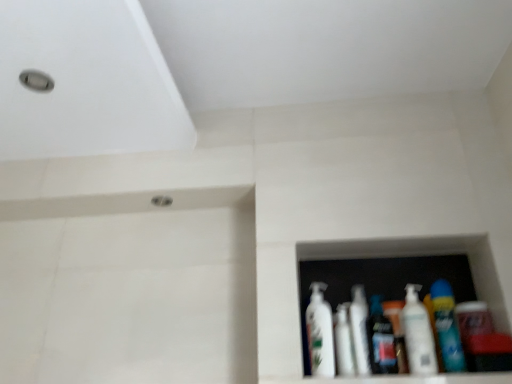
Question: From the image's perspective, is white glossy ledge at lower right beneath white plastic bottle at center, positioned as the first bottle in left-to-right order?

Choices:
 (A) yes
 (B) no

Answer: (A)

Question: Is white plastic bottle at center, positioned as the first bottle in left-to-right order, at the back of white glossy ledge at lower right?

Choices:
 (A) yes
 (B) no

Answer: (B)

Question: Is white glossy ledge at lower right far from white plastic bottle at center, arranged as the 3th bottle when viewed from the right?

Choices:
 (A) yes
 (B) no

Answer: (B)

Question: Is white glossy ledge at lower right wider than white plastic bottle at center, arranged as the 3th bottle when viewed from the right?

Choices:
 (A) yes
 (B) no

Answer: (A)

Question: Is white glossy ledge at lower right further to the viewer compared to white plastic bottle at center, positioned as the first bottle in left-to-right order?

Choices:
 (A) yes
 (B) no

Answer: (B)

Question: Considering the relative sizes of white glossy ledge at lower right and white plastic bottle at center, arranged as the 3th bottle when viewed from the right, in the image provided, is white glossy ledge at lower right thinner than white plastic bottle at center, arranged as the 3th bottle when viewed from the right,?

Choices:
 (A) no
 (B) yes

Answer: (A)

Question: Does white glossy bottle at center, the 2th bottle when ordered from right to left, turn towards white plastic bottle at center, positioned as the first bottle in left-to-right order?

Choices:
 (A) yes
 (B) no

Answer: (B)

Question: Is white glossy bottle at center, the 2th bottle when ordered from left to right, positioned with its back to white plastic bottle at center, positioned as the first bottle in left-to-right order?

Choices:
 (A) no
 (B) yes

Answer: (A)

Question: Is white glossy bottle at center, the 2th bottle when ordered from left to right, to the right of white plastic bottle at center, positioned as the first bottle in left-to-right order, from the viewer's perspective?

Choices:
 (A) no
 (B) yes

Answer: (B)

Question: From a real-world perspective, is white glossy bottle at center, the 2th bottle when ordered from right to left, located beneath white plastic bottle at center, positioned as the first bottle in left-to-right order?

Choices:
 (A) yes
 (B) no

Answer: (A)

Question: Does white glossy bottle at center, the 2th bottle when ordered from right to left, have a greater width compared to white plastic bottle at center, positioned as the first bottle in left-to-right order?

Choices:
 (A) yes
 (B) no

Answer: (B)

Question: Are white glossy bottle at center, the 2th bottle when ordered from left to right, and white plastic bottle at center, positioned as the first bottle in left-to-right order, located far from each other?

Choices:
 (A) yes
 (B) no

Answer: (B)

Question: Does white glossy lotion at center, placed as the 1th toiletry when sorted from left to right, have a greater width compared to white glossy bottle at center, which appears as the first mouthwash when viewed from the left?

Choices:
 (A) no
 (B) yes

Answer: (A)